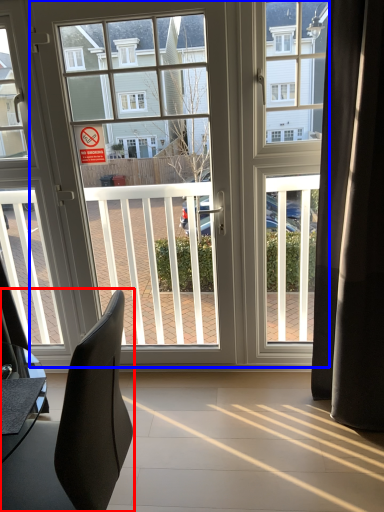
Question: Which object appears closest to the camera in this image, chair (highlighted by a red box) or door (highlighted by a blue box)?

Choices:
 (A) chair
 (B) door

Answer: (A)